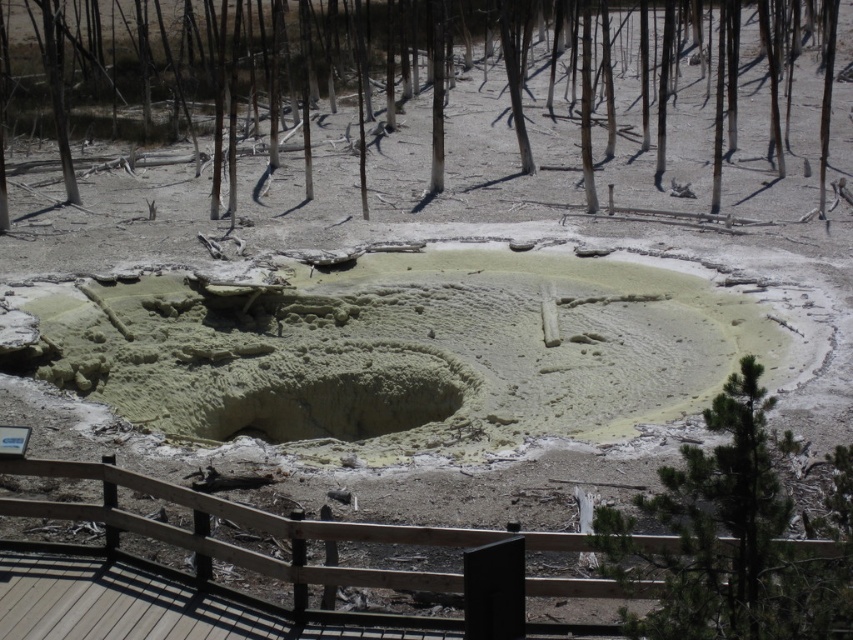
Question: Among these objects, which one is nearest to the camera?

Choices:
 (A) gray bark tree at center
 (B) green leafy tree at right

Answer: (B)

Question: Does gray bark tree at center have a greater width compared to green leafy tree at right?

Choices:
 (A) no
 (B) yes

Answer: (B)

Question: Can you confirm if gray bark tree at center is positioned to the left of green leafy tree at right?

Choices:
 (A) yes
 (B) no

Answer: (A)

Question: Among these objects, which one is nearest to the camera?

Choices:
 (A) green leafy tree at right
 (B) gray bark tree at center

Answer: (A)

Question: Does gray bark tree at center have a larger size compared to green leafy tree at right?

Choices:
 (A) no
 (B) yes

Answer: (B)